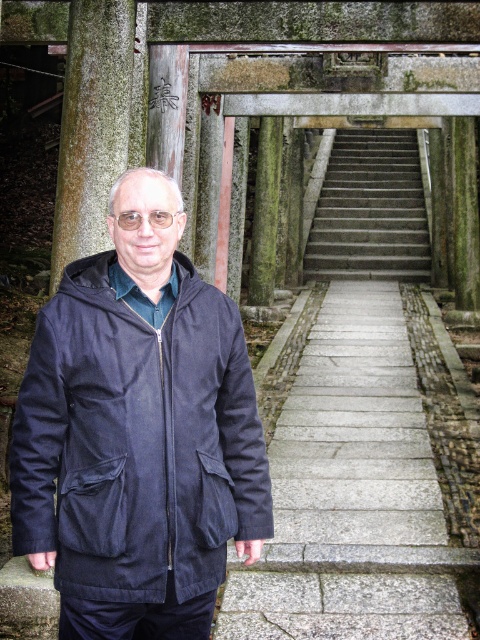
You are a photographer trying to capture the smooth gray stone pillar at center and the green mossy stone pillar at center in a single shot. Which pillar should you focus on first if you want to ensure both are in sharp focus?

The smooth gray stone stone pillar at center is below the green mossy stone pillar at center. To ensure both are in sharp focus, you should focus on the green mossy stone pillar at center first since it is farther away from the camera. This will maximize the depth of field so both pillars are in focus.

You are a photographer trying to capture the smooth gray stone pillar at center and the gray concrete stairs at center in the same frame. Since you want both objects to be clearly visible, which one should you focus on first to ensure sharpness, considering their sizes?

The smooth gray stone pillar at center is thinner than the gray concrete stairs at center, so you should focus on the gray concrete stairs at center first because it has a larger surface area and will be easier to keep in sharp focus.